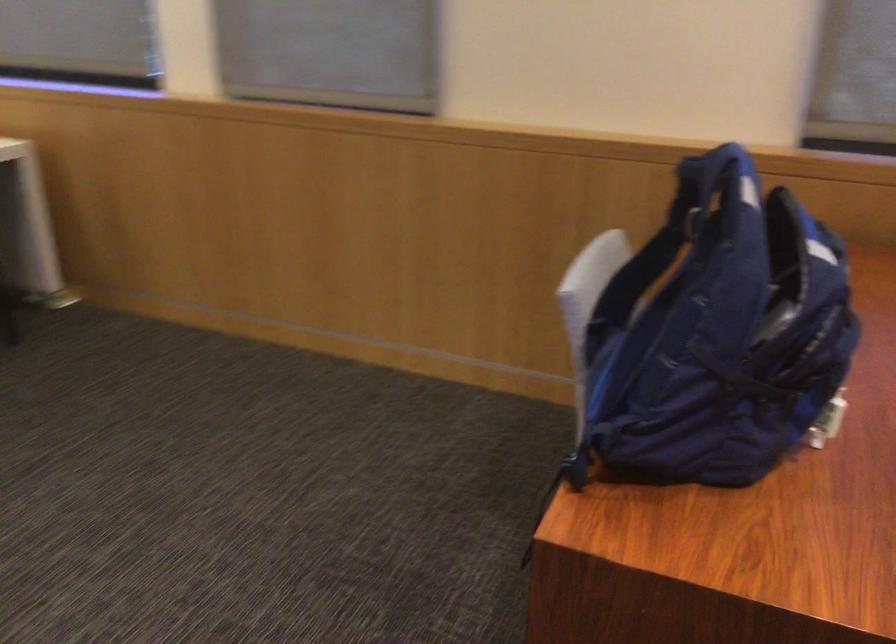
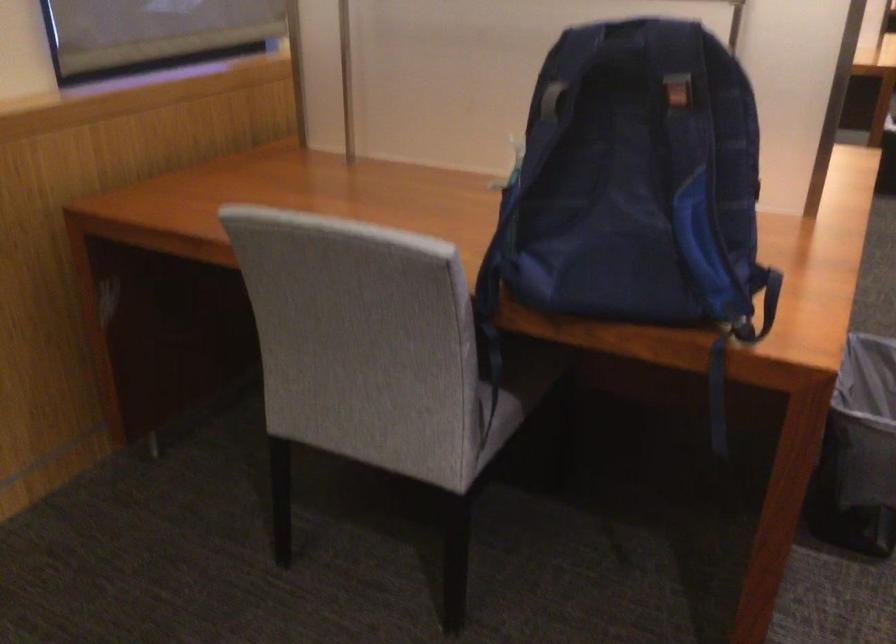
Where in the second image is the point corresponding to (686,214) from the first image?

(552, 100)